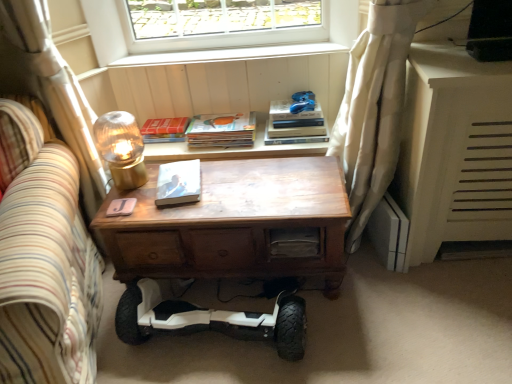
Question: Is hardcover book at upper center, the first paperback book viewed from the back, at the right side of matte white book at center, placed as the first paperback book when sorted from bottom to top?

Choices:
 (A) no
 (B) yes

Answer: (A)

Question: Are hardcover book at upper center, the first paperback book viewed from the back, and matte white book at center, placed as the first paperback book when sorted from bottom to top, beside each other?

Choices:
 (A) yes
 (B) no

Answer: (B)

Question: Is hardcover book at upper center, the first paperback book viewed from the back, to the left of matte white book at center, the 3th paperback book in the back-to-front sequence, from the viewer's perspective?

Choices:
 (A) no
 (B) yes

Answer: (B)

Question: Is hardcover book at upper center, which ranks as the 3th paperback book in front-to-back order, further to camera compared to matte white book at center, the 3th paperback book in the top-to-bottom sequence?

Choices:
 (A) no
 (B) yes

Answer: (B)

Question: Is hardcover book at upper center, which ranks as the 3th paperback book in bottom-to-top order, aimed at matte white book at center, the 3th paperback book in the top-to-bottom sequence?

Choices:
 (A) no
 (B) yes

Answer: (B)

Question: Is point (154, 61) closer or farther from the camera than point (298, 97)?

Choices:
 (A) farther
 (B) closer

Answer: (A)

Question: In terms of width, does white wood window sill at upper center look wider or thinner when compared to blue fabric toy at upper center?

Choices:
 (A) thin
 (B) wide

Answer: (A)

Question: From the image's perspective, is white wood window sill at upper center positioned above or below blue fabric toy at upper center?

Choices:
 (A) above
 (B) below

Answer: (A)

Question: Looking at the image, does white wood window sill at upper center seem bigger or smaller compared to blue fabric toy at upper center?

Choices:
 (A) big
 (B) small

Answer: (A)

Question: Considering the positions of translucent glass lampshade at upper left and matte white book at center, placed as the first paperback book when sorted from front to back, in the image, is translucent glass lampshade at upper left bigger or smaller than matte white book at center, placed as the first paperback book when sorted from front to back,?

Choices:
 (A) small
 (B) big

Answer: (B)

Question: In terms of width, does translucent glass lampshade at upper left look wider or thinner when compared to matte white book at center, the 3th paperback book in the back-to-front sequence?

Choices:
 (A) wide
 (B) thin

Answer: (B)

Question: Relative to matte white book at center, placed as the first paperback book when sorted from front to back, is translucent glass lampshade at upper left in front or behind?

Choices:
 (A) behind
 (B) front

Answer: (B)

Question: Does point (131, 168) appear closer or farther from the camera than point (181, 190)?

Choices:
 (A) closer
 (B) farther

Answer: (B)

Question: Is blue fabric toy at upper center inside the boundaries of hardcover book at upper center, which ranks as the 3th paperback book in bottom-to-top order, or outside?

Choices:
 (A) inside
 (B) outside

Answer: (B)

Question: From a real-world perspective, relative to hardcover book at upper center, placed as the 1th paperback book when sorted from top to bottom, is blue fabric toy at upper center vertically above or below?

Choices:
 (A) below
 (B) above

Answer: (B)